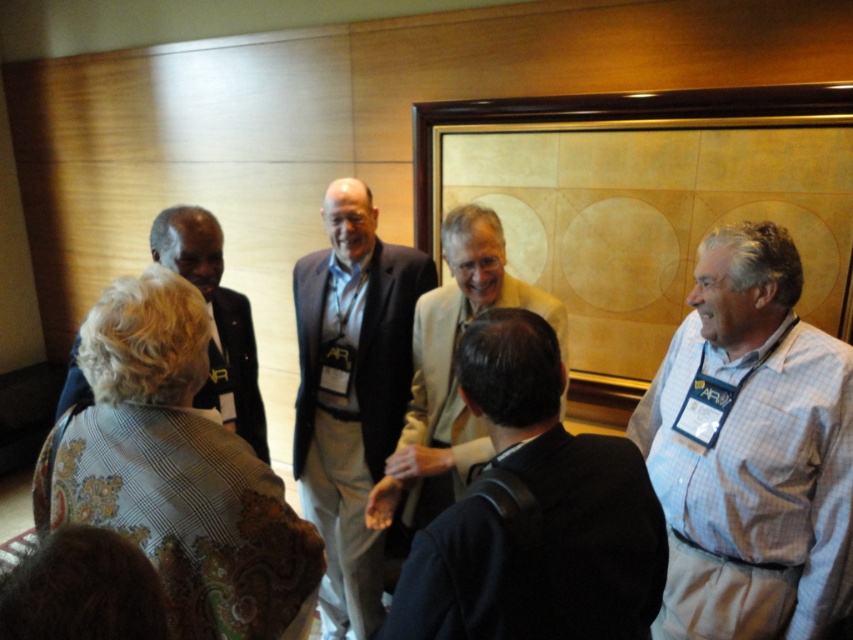
Question: Which object is farther from the camera taking this photo?

Choices:
 (A) patterned fabric jacket at center
 (B) black fabric suit at left

Answer: (A)

Question: Which point is farther from the camera taking this photo?

Choices:
 (A) (222, 412)
 (B) (352, 198)
 (C) (374, 573)
 (D) (466, 490)

Answer: (C)

Question: Can you confirm if white checkered shirt at right is positioned to the right of black fabric suit at left?

Choices:
 (A) no
 (B) yes

Answer: (B)

Question: Is black fabric suit at left in front of patterned fabric jacket at center?

Choices:
 (A) yes
 (B) no

Answer: (A)

Question: Considering the relative positions of dark blue sweater at center and light beige suit at center in the image provided, where is dark blue sweater at center located with respect to light beige suit at center?

Choices:
 (A) left
 (B) right

Answer: (B)

Question: Which object is positioned farthest from the dark blue suit at center?

Choices:
 (A) patterned fabric jacket at center
 (B) dark blue sweater at center
 (C) black fabric suit at left

Answer: (B)